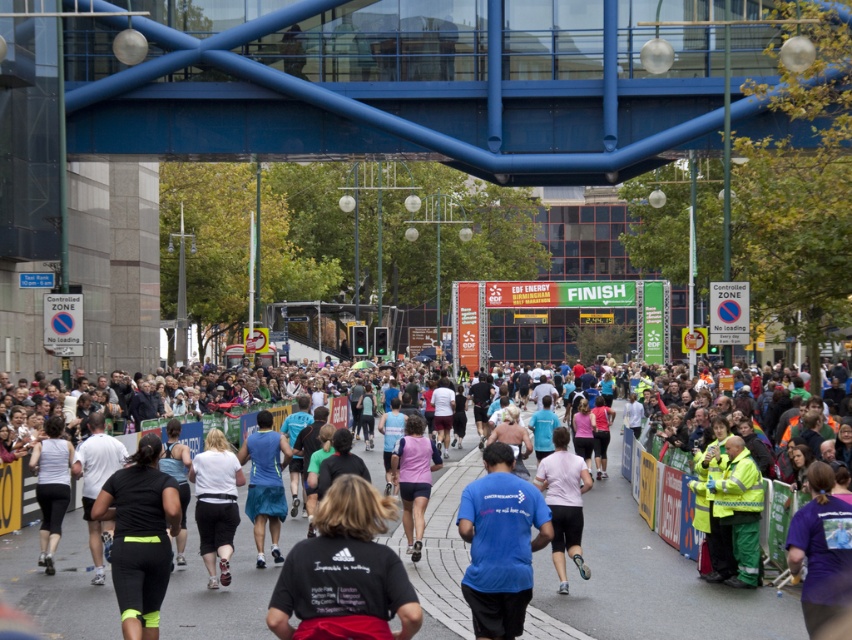
You are a photographer at the marathon finish line. You want to take a photo that includes both the blue metallic bridge at upper center and the white cotton shirt at center. Which object should you focus on first to ensure both are in frame?

You should focus on the blue metallic bridge at upper center first because it is much taller than the white cotton shirt at center, so adjusting the camera angle to include its height will naturally include the shorter object in the frame.

You are a runner approaching the finish line and see the blue metallic bridge at upper center and the white cotton shirt at center. Which object is closer to you as you run towards the finish line?

The white cotton shirt at center is closer to you because the blue metallic bridge at upper center is further away from the viewer.

You are a drone operator assigned to capture aerial footage of the marathon finish line. Your drone is currently positioned at the blue metallic bridge at upper center. The safety regulations state that the drone must maintain a minimum distance of 25 meters from any structure. Is your current position compliant with the safety regulations?

The distance between the blue metallic bridge at upper center and the viewer is 24.70 meters, which is less than the required 25 meters. Therefore, the current position is not compliant with the safety regulations.